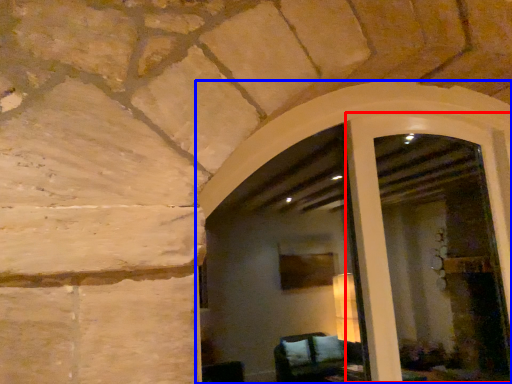
Question: Which object is closer to the camera taking this photo, screen door (highlighted by a red box) or window frame (highlighted by a blue box)?

Choices:
 (A) screen door
 (B) window frame

Answer: (B)